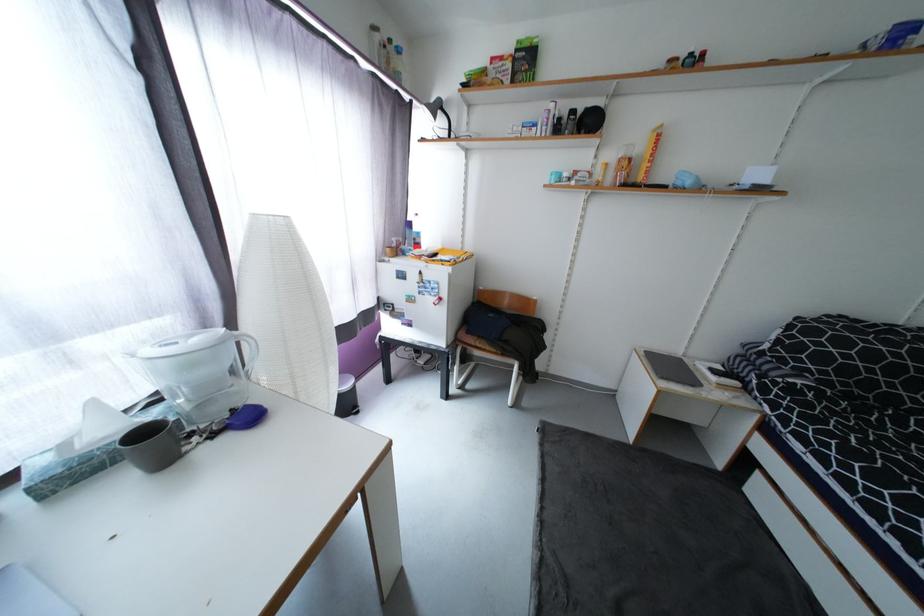
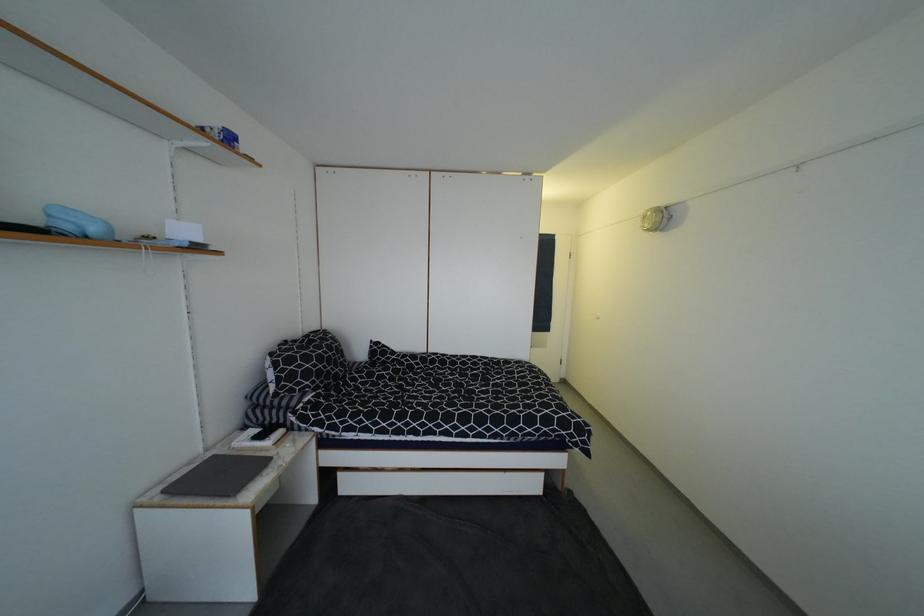
Locate, in the second image, the point that corresponds to [685,185] in the first image.

(71, 228)